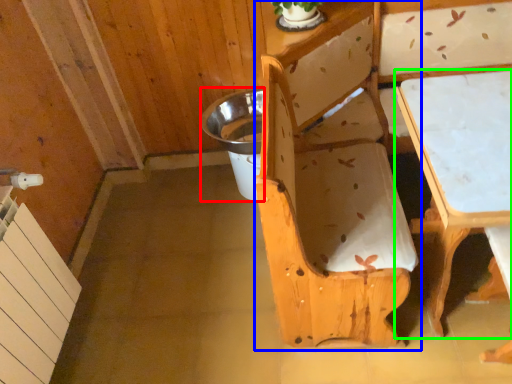
Question: Which object is positioned closest to potty (highlighted by a red box)? Select from chair (highlighted by a blue box) and table (highlighted by a green box).

Choices:
 (A) chair
 (B) table

Answer: (A)